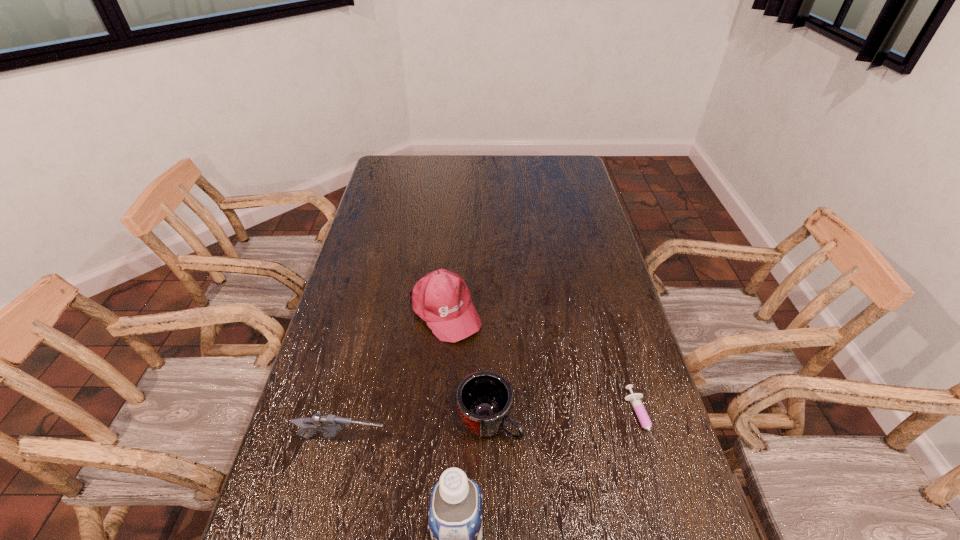
Identify the location of vacant space situated 0.250m at the front of the farthest object with the brim. (512, 403).

Locate an element on the screen. free space located 0.050m at the front of the farthest object with the brim is located at coordinates click(x=471, y=352).

Find the location of `vacant area located 0.180m on the side of the mug with the handle`. vacant area located 0.180m on the side of the mug with the handle is located at coordinates (578, 489).

The height and width of the screenshot is (540, 960). Find the location of `vacant space located 0.270m on the side of the mug with the handle`. vacant space located 0.270m on the side of the mug with the handle is located at coordinates (613, 516).

Image resolution: width=960 pixels, height=540 pixels. Find the location of `blank space located 0.170m on the side of the mug with the handle`. blank space located 0.170m on the side of the mug with the handle is located at coordinates (574, 485).

What are the coordinates of `object located in the left edge section of the desktop` in the screenshot? It's located at (332, 424).

The image size is (960, 540). I want to click on object at the right edge, so click(x=635, y=399).

Find the location of a particular element. Image resolution: width=960 pixels, height=540 pixels. free space at the far edge is located at coordinates (536, 178).

I want to click on free space at the left edge of the desktop, so click(x=311, y=450).

Locate an element on the screen. Image resolution: width=960 pixels, height=540 pixels. blank space at the right edge of the desktop is located at coordinates (560, 215).